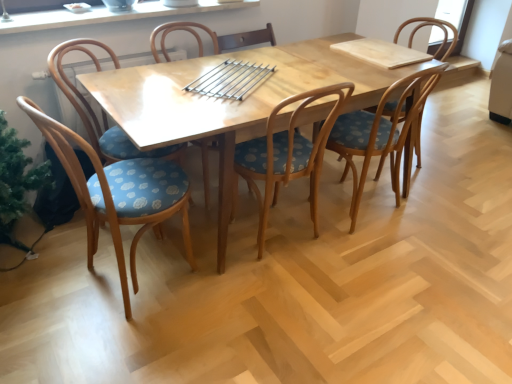
The image size is (512, 384). I want to click on vacant space that's between wooden chair with blue polka dot seat cushion at center, the 2th chair when ordered from right to left, and wooden chair with blue polka dot seat at center, which ranks as the 3th chair in right-to-left order, so click(x=335, y=232).